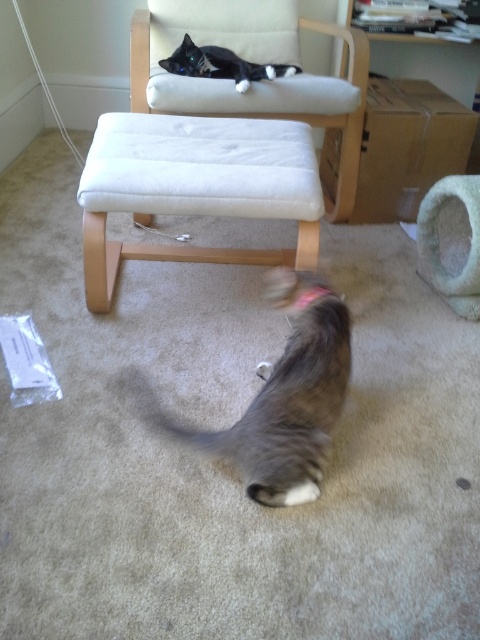
You are standing in the room and want to place a treat for the gray tabby cat with a pink collar that is moving towards you. The treat needs to be placed exactly at the point labeled point (162, 81). Considering the distance from where you are standing, will the treat be within reach of the gray tabby cat with a pink collar?

The point labeled point (162, 81) is 6.87 feet away from the viewer. Since the gray tabby cat with a pink collar is moving towards the camera, it can likely reach the treat placed at that point as it is within a reasonable distance for a cat to approach.

You are a cat owner who wants to ensure your cats have enough space to move around. Based on the image, can the gray striped cat at lower center reach the soft green fabric cat bed at lower right without stepping on the chair where the other cat is resting?

The gray striped cat at lower center is in front of the soft green fabric cat bed at lower right, meaning it is closer to the bed and can easily reach it without needing to go near the chair where the other cat is resting.